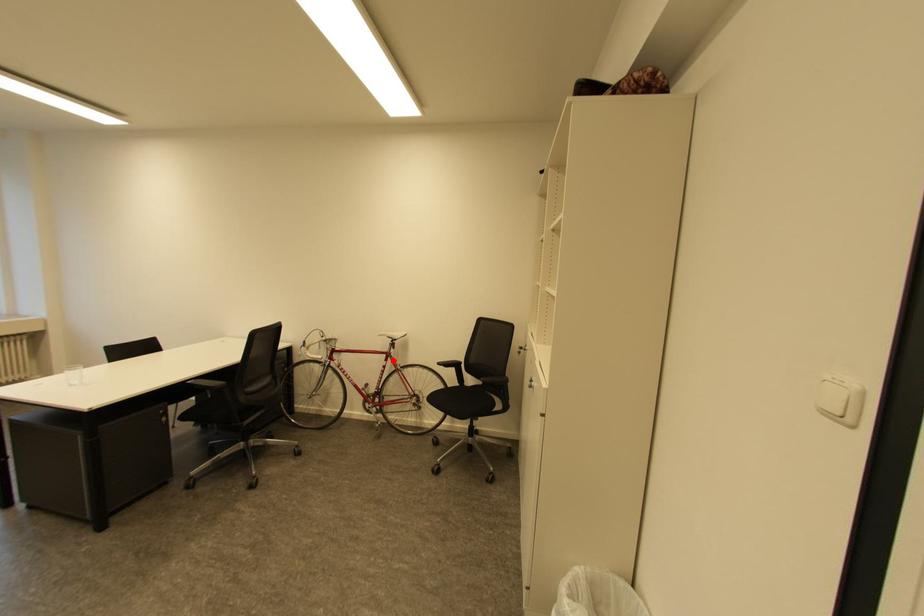
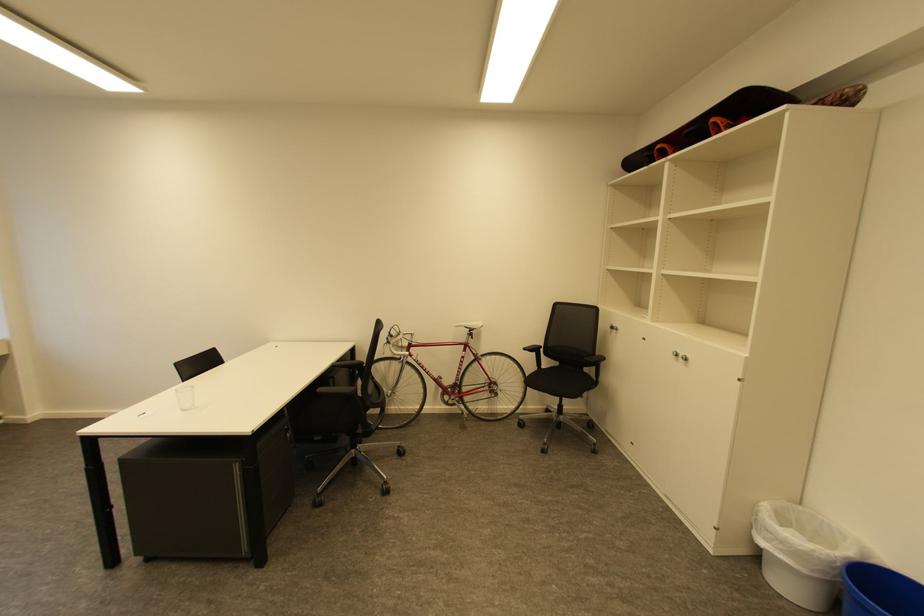
Locate, in the second image, the point that corresponds to the highlighted location in the first image.

(471, 351)